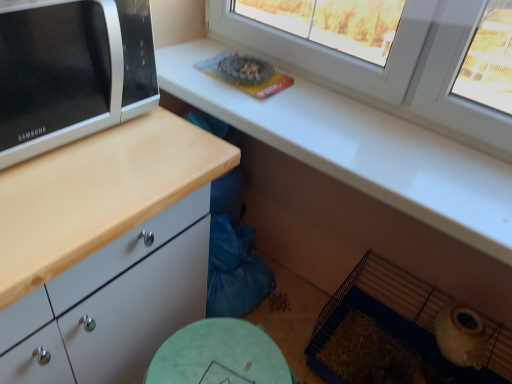
Measure the distance between point (104,113) and camera.

Point (104,113) and camera are 34.17 inches apart from each other.

Describe the element at coordinates (67, 71) in the screenshot. I see `white glossy microwave at left` at that location.

You are a GUI agent. You are given a task and a screenshot of the screen. Output one action in this format:
    pyautogui.click(x=<x>, y=<y>)
    Task: Click on the white glossy microwave at left
    
    Given the screenshot: What is the action you would take?
    point(67,71)

Measure the distance between white glossy microwave at left and camera.

They are 25.79 inches apart.

What do you see at coordinates (388, 67) in the screenshot? I see `white plastic window at upper center` at bounding box center [388, 67].

What are the coordinates of `white plastic window at upper center` in the screenshot? It's located at (388, 67).

Looking at this image, what is the approximate height of white plastic window at upper center?

white plastic window at upper center is 30.16 centimeters tall.

Find the location of `white glossy microwave at left`. white glossy microwave at left is located at coordinates (67, 71).

From the picture: Visually, is white glossy microwave at left positioned to the left or to the right of white plastic window at upper center?

From the image, it's evident that white glossy microwave at left is to the left of white plastic window at upper center.

In the scene shown: Is white glossy microwave at left in front of white plastic window at upper center?

Yes.

Is point (73, 86) closer or farther from the camera than point (291, 60)?

Clearly, point (73, 86) is closer to the camera than point (291, 60).

From the image's perspective, relative to white plastic window at upper center, is white glossy microwave at left above or below?

From the image's perspective, white glossy microwave at left appears below white plastic window at upper center.

From a real-world perspective, is white glossy microwave at left physically below white plastic window at upper center?

→ No, from a real-world perspective, white glossy microwave at left is not beneath white plastic window at upper center.

From the picture: Which object is wider, white glossy microwave at left or white plastic window at upper center?

white glossy microwave at left is wider.

From the picture: Can you confirm if white glossy microwave at left is taller than white plastic window at upper center?

No, white glossy microwave at left is not taller than white plastic window at upper center.

Is white glossy microwave at left smaller than white plastic window at upper center?

Actually, white glossy microwave at left might be larger than white plastic window at upper center.

Is white glossy microwave at left inside the boundaries of white plastic window at upper center, or outside?

white glossy microwave at left lies outside white plastic window at upper center.

Is white glossy microwave at left placed right next to white plastic window at upper center?

They are not placed beside each other.

Is white glossy microwave at left looking in the opposite direction of white plastic window at upper center?

No, white glossy microwave at left is not facing away from white plastic window at upper center.

Can you tell me how much white glossy microwave at left and white plastic window at upper center differ in facing direction?

87 degrees separate the facing orientations of white glossy microwave at left and white plastic window at upper center.

At what (x,y) coordinates should I click in order to perform the action: click on microwave oven that is on the left side of white plastic window at upper center. Please return your answer as a coordinate pair (x, y). Image resolution: width=512 pixels, height=384 pixels. Looking at the image, I should click on (67, 71).

Considering the relative positions of white plastic window at upper center and white glossy microwave at left in the image provided, is white plastic window at upper center to the right of white glossy microwave at left from the viewer's perspective?

Correct, you'll find white plastic window at upper center to the right of white glossy microwave at left.

Which object is more forward, white plastic window at upper center or white glossy microwave at left?

white glossy microwave at left is more forward.

Is point (244, 28) positioned behind point (132, 86)?

That is True.

From the image's perspective, which is above, white plastic window at upper center or white glossy microwave at left?

white plastic window at upper center.

From a real-world perspective, who is located higher, white plastic window at upper center or white glossy microwave at left?

white glossy microwave at left is physically above.

Is white plastic window at upper center thinner than white glossy microwave at left?

Indeed, white plastic window at upper center has a lesser width compared to white glossy microwave at left.

Can you confirm if white plastic window at upper center is taller than white glossy microwave at left?

Indeed, white plastic window at upper center has a greater height compared to white glossy microwave at left.

Is white plastic window at upper center smaller than white glossy microwave at left?

Correct, white plastic window at upper center occupies less space than white glossy microwave at left.

Would you say white plastic window at upper center is outside white glossy microwave at left?

Indeed, white plastic window at upper center is completely outside white glossy microwave at left.

Is white plastic window at upper center positioned far away from white glossy microwave at left?

Actually, white plastic window at upper center and white glossy microwave at left are a little close together.

Is white plastic window at upper center turned away from white glossy microwave at left?

white plastic window at upper center does not have its back to white glossy microwave at left.

How many degrees apart are the facing directions of white plastic window at upper center and white glossy microwave at left?

The facing directions of white plastic window at upper center and white glossy microwave at left are 87 degrees apart.

Locate an element on the screen. window above the white glossy microwave at left (from the image's perspective) is located at coordinates (388, 67).

Identify the location of window located behind the white glossy microwave at left. (388, 67).

The image size is (512, 384). I want to click on microwave oven in front of the white plastic window at upper center, so click(67, 71).